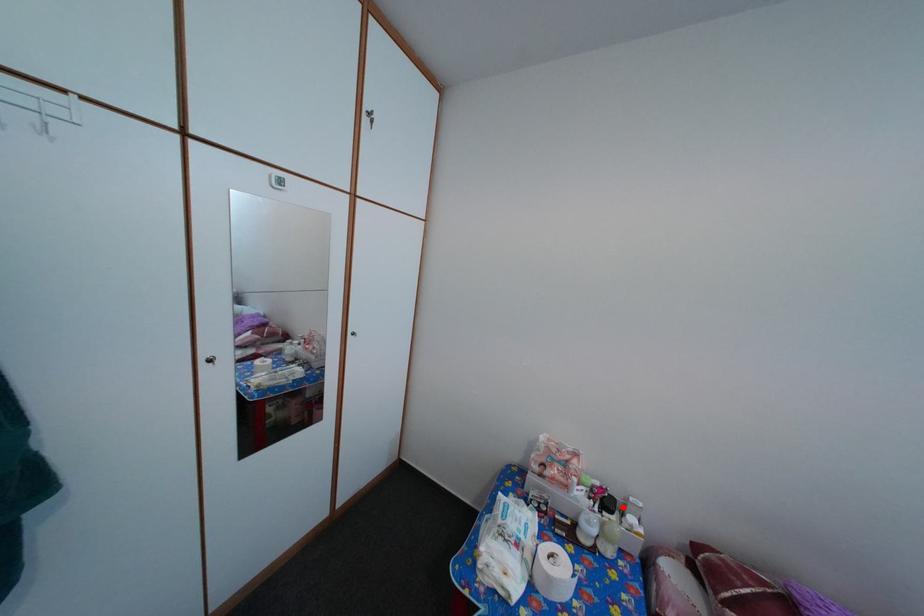
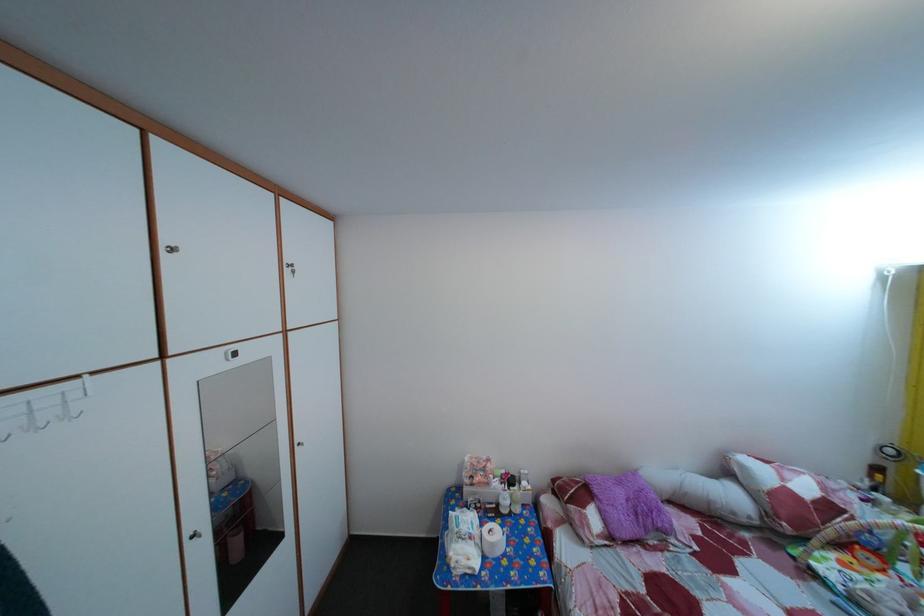
Locate, in the second image, the point that corresponds to the highlighted location in the first image.

(524, 485)